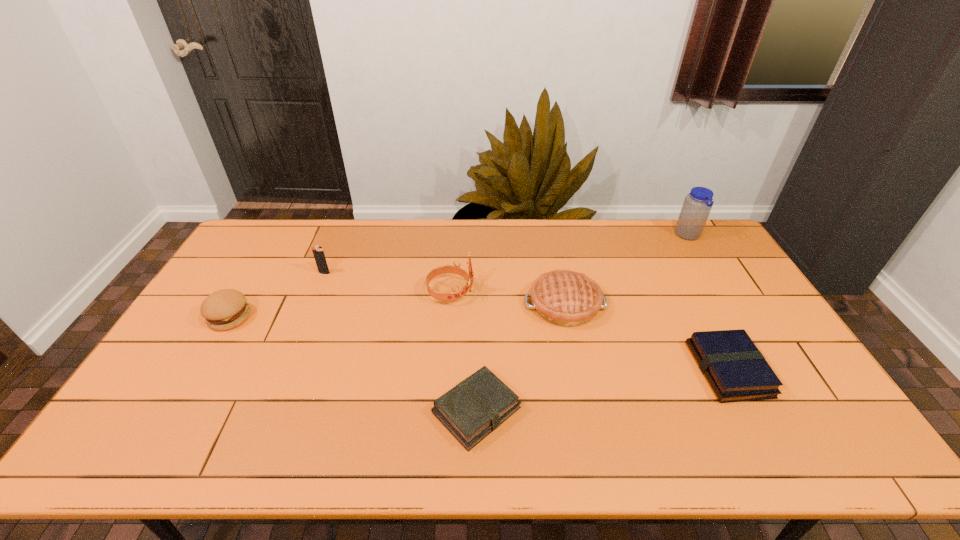
Where is `water bottle that is at the right edge`? The image size is (960, 540). water bottle that is at the right edge is located at coordinates (697, 205).

Find the location of a particular element. The width and height of the screenshot is (960, 540). book located at the right edge is located at coordinates (735, 369).

Where is `object that is positioned at the far right corner`? object that is positioned at the far right corner is located at coordinates (697, 205).

In the image, there is a desktop. Where is `vacant space at the far edge`? The image size is (960, 540). vacant space at the far edge is located at coordinates (555, 244).

At what (x,y) coordinates should I click in order to perform the action: click on vacant area at the near edge. Please return your answer as a coordinate pair (x, y). This screenshot has width=960, height=540. Looking at the image, I should click on (240, 439).

Where is `blank space at the left edge`? blank space at the left edge is located at coordinates (255, 274).

At what (x,y) coordinates should I click in order to perform the action: click on vacant area at the right edge. Please return your answer as a coordinate pair (x, y). The image size is (960, 540). Looking at the image, I should click on (756, 346).

The width and height of the screenshot is (960, 540). Identify the location of free space at the far right corner. tap(672, 237).

Where is `free point between the hamburger and the third tallest object`? The width and height of the screenshot is (960, 540). free point between the hamburger and the third tallest object is located at coordinates (277, 295).

At what (x,y) coordinates should I click in order to perform the action: click on unoccupied area between the left book and the tiara. Please return your answer as a coordinate pair (x, y). Image resolution: width=960 pixels, height=540 pixels. Looking at the image, I should click on (464, 351).